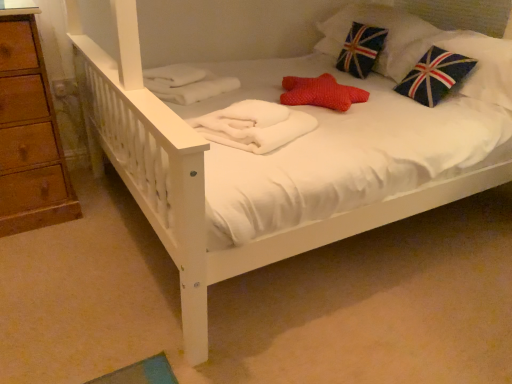
At what (x,y) coordinates should I click in order to perform the action: click on free point above white fluffy blanket at center (from a real-world perspective). Please return your answer as a coordinate pair (x, y). This screenshot has height=384, width=512. Looking at the image, I should click on (253, 118).